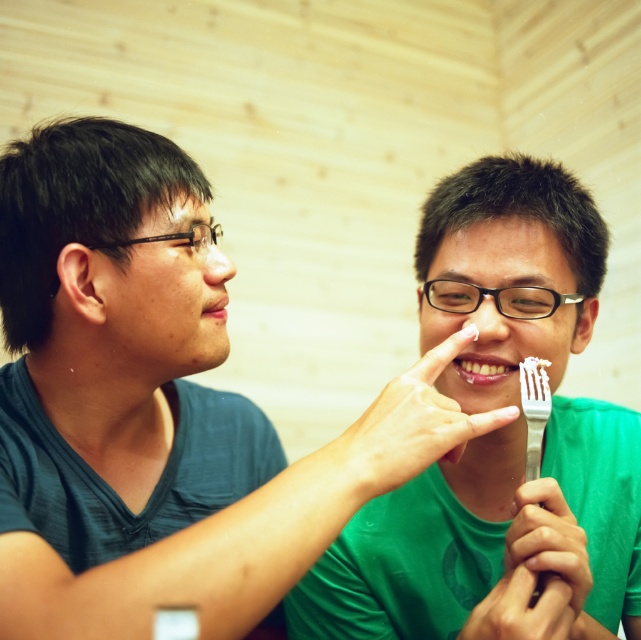
Where is `metallic silver fork at center`? metallic silver fork at center is located at coordinates (542, 563).

Which of these two, metallic silver fork at center or silver metallic fork at right, stands taller?

silver metallic fork at right is taller.

Locate an element on the screen. The image size is (641, 640). metallic silver fork at center is located at coordinates (542, 563).

Between point (478, 605) and point (533, 385), which one is positioned behind?

The point (533, 385) is more distant.

Is point (519, 621) more distant than point (528, 449)?

No, (519, 621) is closer to viewer.

You are a GUI agent. You are given a task and a screenshot of the screen. Output one action in this format:
    pyautogui.click(x=<x>, y=<y>)
    Task: Click on the smooth skin hand at center
    The image size is (641, 640).
    Given the screenshot: What is the action you would take?
    pyautogui.click(x=522, y=609)

The image size is (641, 640). In order to click on smooth skin hand at center in this screenshot , I will do `click(522, 609)`.

Does silver metallic fork at right have a larger size compared to bright white teeth at center?

Indeed, silver metallic fork at right has a larger size compared to bright white teeth at center.

Does point (547, 360) come behind point (463, 376)?

That is False.

Locate an element on the screen. The width and height of the screenshot is (641, 640). silver metallic fork at right is located at coordinates (535, 410).